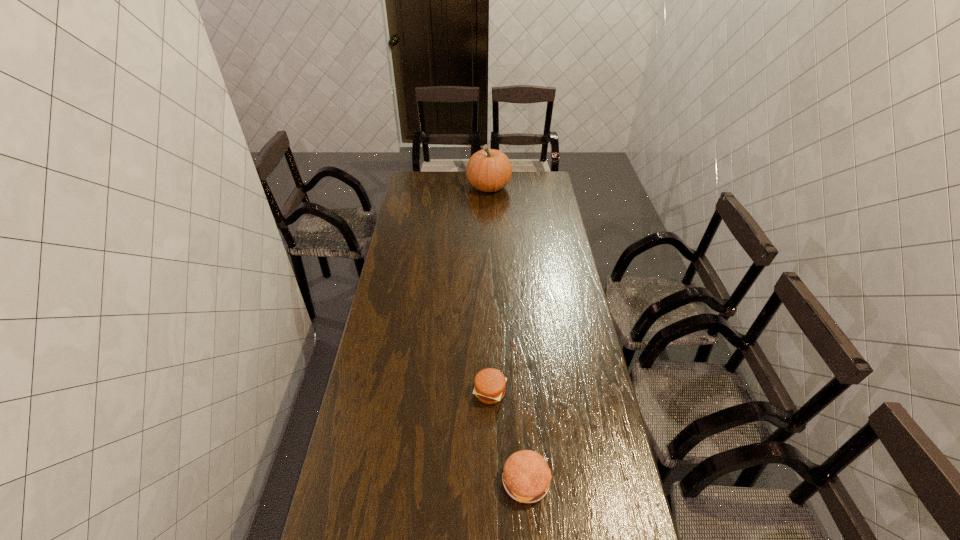
I want to click on free area in between the nearest object and the tallest object, so click(x=508, y=334).

At what (x,y) coordinates should I click in order to perform the action: click on empty space that is in between the pumpkin and the nearest object. Please return your answer as a coordinate pair (x, y). Looking at the image, I should click on (508, 334).

In order to click on free spot between the pumpkin and the farther hamburger in this screenshot , I will do (x=490, y=289).

Image resolution: width=960 pixels, height=540 pixels. What are the coordinates of `free area in between the tallest object and the nearest object` in the screenshot? It's located at point(508,334).

At what (x,y) coordinates should I click in order to perform the action: click on the second closest object to the nearer hamburger. Please return your answer as a coordinate pair (x, y). The image size is (960, 540). Looking at the image, I should click on (488, 170).

This screenshot has width=960, height=540. I want to click on object identified as the closest to the pumpkin, so click(490, 383).

In order to click on vacant space that satisfies the following two spatial constraints: 1. on the back side of the nearer hamburger; 2. on the stem of the tallest object in this screenshot , I will do `click(504, 187)`.

Find the location of a particular element. free spot that satisfies the following two spatial constraints: 1. on the stem of the nearer hamburger; 2. on the left side of the pumpkin is located at coordinates (497, 481).

Identify the location of vacant area that satisfies the following two spatial constraints: 1. on the stem of the tallest object; 2. on the left side of the nearer hamburger. (497, 481).

At what (x,y) coordinates should I click in order to perform the action: click on vacant area that satisfies the following two spatial constraints: 1. on the stem of the nearest object; 2. on the left side of the pumpkin. Please return your answer as a coordinate pair (x, y). This screenshot has height=540, width=960. Looking at the image, I should click on coord(497,481).